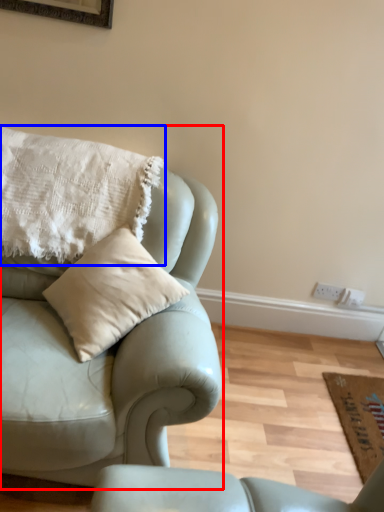
Question: Which object appears farthest to the camera in this image, studio couch (highlighted by a red box) or pillow (highlighted by a blue box)?

Choices:
 (A) studio couch
 (B) pillow

Answer: (B)